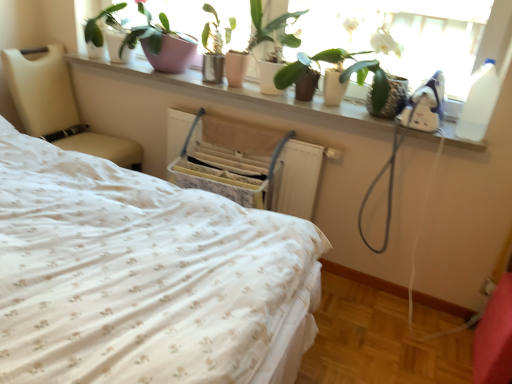
This screenshot has width=512, height=384. What do you see at coordinates (262, 40) in the screenshot? I see `green matte plant at upper center, arranged as the 1th houseplant when viewed from the right` at bounding box center [262, 40].

Where is `white ceramic plants at upper center`? white ceramic plants at upper center is located at coordinates (252, 97).

Locate an element on the screen. The image size is (512, 384). beige leather chair at left is located at coordinates (59, 107).

The image size is (512, 384). What do you see at coordinates (130, 29) in the screenshot?
I see `matte white pot at upper center` at bounding box center [130, 29].

Identify the location of green matte plant at upper center, arranged as the 1th houseplant when viewed from the right. (262, 40).

The width and height of the screenshot is (512, 384). There is a green matte plant at upper center, acting as the second houseplant starting from the left. What are the coordinates of `plant above it (from a real-world perspective)` in the screenshot? It's located at (130, 29).

Is point (302, 14) farther from viewer compared to point (348, 76)?

No.

Based on the photo, would you say matte white pot at upper center is part of green matte plant at upper center, arranged as the 1th houseplant when viewed from the right,'s contents?

Actually, matte white pot at upper center is outside green matte plant at upper center, arranged as the 1th houseplant when viewed from the right.

Does green matte plant at upper center, arranged as the 1th houseplant when viewed from the right, contain pink ceramic pot at upper center, acting as the second houseplant starting from the right?

No, green matte plant at upper center, arranged as the 1th houseplant when viewed from the right, does not contain pink ceramic pot at upper center, acting as the second houseplant starting from the right.

Which object is wider, green matte plant at upper center, arranged as the 1th houseplant when viewed from the right, or pink ceramic pot at upper center, which is counted as the first houseplant, starting from the left?

pink ceramic pot at upper center, which is counted as the first houseplant, starting from the left.

Can you confirm if green matte plant at upper center, acting as the second houseplant starting from the left, is positioned to the right of pink ceramic pot at upper center, acting as the second houseplant starting from the right?

Correct, you'll find green matte plant at upper center, acting as the second houseplant starting from the left, to the right of pink ceramic pot at upper center, acting as the second houseplant starting from the right.

Considering the positions of points (275, 59) and (108, 15), is point (275, 59) closer to camera compared to point (108, 15)?

Yes.

Based on the photo, from the image's perspective, which one is positioned lower, wooden swivel chair at center or matte white pot at upper center?

wooden swivel chair at center.

Is wooden swivel chair at center not near matte white pot at upper center?

No, there isn't a large distance between wooden swivel chair at center and matte white pot at upper center.

Considering the sizes of objects wooden swivel chair at center and matte white pot at upper center in the image provided, who is smaller, wooden swivel chair at center or matte white pot at upper center?

Smaller between the two is wooden swivel chair at center.

Considering the sizes of objects wooden swivel chair at center and matte white pot at upper center in the image provided, who is thinner, wooden swivel chair at center or matte white pot at upper center?

Thinner between the two is matte white pot at upper center.

Which object is closer to the camera, pink ceramic pot at upper center, which is counted as the first houseplant, starting from the left, or white ceramic plants at upper center?

white ceramic plants at upper center is closer to the camera.

In the scene shown: Is pink ceramic pot at upper center, which is counted as the first houseplant, starting from the left, shorter than white ceramic plants at upper center?

Incorrect, the height of pink ceramic pot at upper center, which is counted as the first houseplant, starting from the left, does not fall short of that of white ceramic plants at upper center.

From the image's perspective, relative to white ceramic plants at upper center, is pink ceramic pot at upper center, acting as the second houseplant starting from the right, above or below?

Based on their image positions, pink ceramic pot at upper center, acting as the second houseplant starting from the right, is located above white ceramic plants at upper center.

From a real-world perspective, which is physically below, white ceramic plants at upper center or green matte plant at upper center, arranged as the 1th houseplant when viewed from the right?

In real-world perspective, white ceramic plants at upper center is lower.

How many degrees apart are the facing directions of white ceramic plants at upper center and green matte plant at upper center, arranged as the 1th houseplant when viewed from the right?

The angular difference between white ceramic plants at upper center and green matte plant at upper center, arranged as the 1th houseplant when viewed from the right, is 1.11 degrees.

Based on their sizes in the image, would you say white ceramic plants at upper center is bigger or smaller than green matte plant at upper center, arranged as the 1th houseplant when viewed from the right?

Considering their sizes, white ceramic plants at upper center takes up less space than green matte plant at upper center, arranged as the 1th houseplant when viewed from the right.

Are white ceramic plants at upper center and green matte plant at upper center, acting as the second houseplant starting from the left, beside each other?

white ceramic plants at upper center and green matte plant at upper center, acting as the second houseplant starting from the left, are not in contact.

Are white floral fabric bed at center and beige leather chair at left making contact?

white floral fabric bed at center is not next to beige leather chair at left, and they're not touching.

Considering the points (7, 366) and (67, 111), which point is behind, point (7, 366) or point (67, 111)?

The point (67, 111) is farther.

Between pink ceramic pot at upper center, acting as the second houseplant starting from the right, and green matte plant at upper center, acting as the second houseplant starting from the left, which one has smaller size?

Smaller between the two is pink ceramic pot at upper center, acting as the second houseplant starting from the right.

Considering the sizes of pink ceramic pot at upper center, which is counted as the first houseplant, starting from the left, and green matte plant at upper center, acting as the second houseplant starting from the left, in the image, is pink ceramic pot at upper center, which is counted as the first houseplant, starting from the left, wider or thinner than green matte plant at upper center, acting as the second houseplant starting from the left,?

In the image, pink ceramic pot at upper center, which is counted as the first houseplant, starting from the left, appears to be wider than green matte plant at upper center, acting as the second houseplant starting from the left.

Is pink ceramic pot at upper center, acting as the second houseplant starting from the right, not near green matte plant at upper center, acting as the second houseplant starting from the left?

No, pink ceramic pot at upper center, acting as the second houseplant starting from the right, is in close proximity to green matte plant at upper center, acting as the second houseplant starting from the left.

From a real-world perspective, which is physically below, pink ceramic pot at upper center, which is counted as the first houseplant, starting from the left, or green matte plant at upper center, arranged as the 1th houseplant when viewed from the right?

pink ceramic pot at upper center, which is counted as the first houseplant, starting from the left, is physically lower.

You are a GUI agent. You are given a task and a screenshot of the screen. Output one action in this format:
    pyautogui.click(x=<x>, y=<y>)
    Task: Click on the plant that appears above the green matte plant at upper center, arranged as the 1th houseplant when viewed from the right (from a real-world perspective)
    This screenshot has height=384, width=512.
    Given the screenshot: What is the action you would take?
    pyautogui.click(x=130, y=29)

The width and height of the screenshot is (512, 384). I want to click on houseplant that appears on the left of green matte plant at upper center, arranged as the 1th houseplant when viewed from the right, so click(x=161, y=43).

When comparing their distances from white floral fabric bed at center, does green matte plant at upper center, acting as the second houseplant starting from the left, or pink ceramic pot at upper center, which is counted as the first houseplant, starting from the left, seem closer?

green matte plant at upper center, acting as the second houseplant starting from the left, is positioned closer to the anchor white floral fabric bed at center.

Which object lies further to the anchor point wooden swivel chair at center, pink ceramic pot at upper center, which is counted as the first houseplant, starting from the left, or matte white pot at upper center?

Among the two, pink ceramic pot at upper center, which is counted as the first houseplant, starting from the left, is located further to wooden swivel chair at center.

Considering their positions, is white ceramic plants at upper center positioned closer to matte white pot at upper center than wooden swivel chair at center?

The object closer to matte white pot at upper center is white ceramic plants at upper center.

Estimate the real-world distances between objects in this image. Which object is further from white ceramic plants at upper center, beige leather chair at left or green matte plant at upper center, arranged as the 1th houseplant when viewed from the right?

beige leather chair at left.

Looking at this image, when comparing their distances from green matte plant at upper center, acting as the second houseplant starting from the left, does white floral fabric bed at center or wooden swivel chair at center seem further?

Among the two, white floral fabric bed at center is located further to green matte plant at upper center, acting as the second houseplant starting from the left.

From the image, which object appears to be nearer to white ceramic plants at upper center, green matte plant at upper center, arranged as the 1th houseplant when viewed from the right, or wooden swivel chair at center?

wooden swivel chair at center is positioned closer to the anchor white ceramic plants at upper center.

Estimate the real-world distances between objects in this image. Which object is closer to matte white pot at upper center, white ceramic plants at upper center or green matte plant at upper center, arranged as the 1th houseplant when viewed from the right?

Among the two, green matte plant at upper center, arranged as the 1th houseplant when viewed from the right, is located nearer to matte white pot at upper center.

Considering their positions, is wooden swivel chair at center positioned further to pink ceramic pot at upper center, acting as the second houseplant starting from the right, than white floral fabric bed at center?

white floral fabric bed at center lies further to pink ceramic pot at upper center, acting as the second houseplant starting from the right, than the other object.

Locate an element on the screen. houseplant located between white floral fabric bed at center and beige leather chair at left in the depth direction is located at coordinates (262, 40).

The width and height of the screenshot is (512, 384). Identify the location of plant between white floral fabric bed at center and wooden swivel chair at center along the z-axis. (130, 29).

This screenshot has width=512, height=384. Find the location of `ledge located between beige leather chair at left and green matte plant at upper center, acting as the second houseplant starting from the left, in the left-right direction`. ledge located between beige leather chair at left and green matte plant at upper center, acting as the second houseplant starting from the left, in the left-right direction is located at coordinates (252, 97).

The image size is (512, 384). Find the location of `ledge between pink ceramic pot at upper center, acting as the second houseplant starting from the right, and matte white pot at upper center, in the horizontal direction`. ledge between pink ceramic pot at upper center, acting as the second houseplant starting from the right, and matte white pot at upper center, in the horizontal direction is located at coordinates (252, 97).